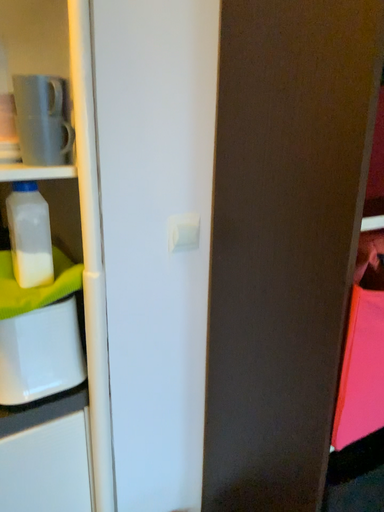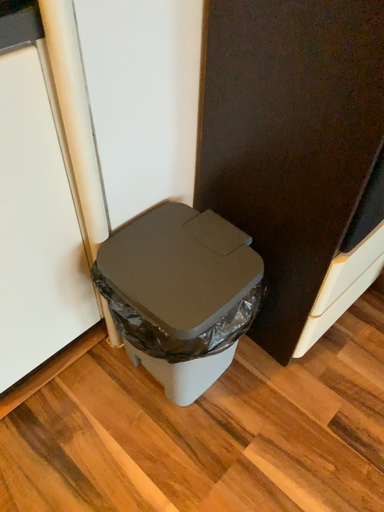
Question: How did the camera likely rotate when shooting the video?

Choices:
 (A) rotated downward
 (B) rotated upward

Answer: (A)